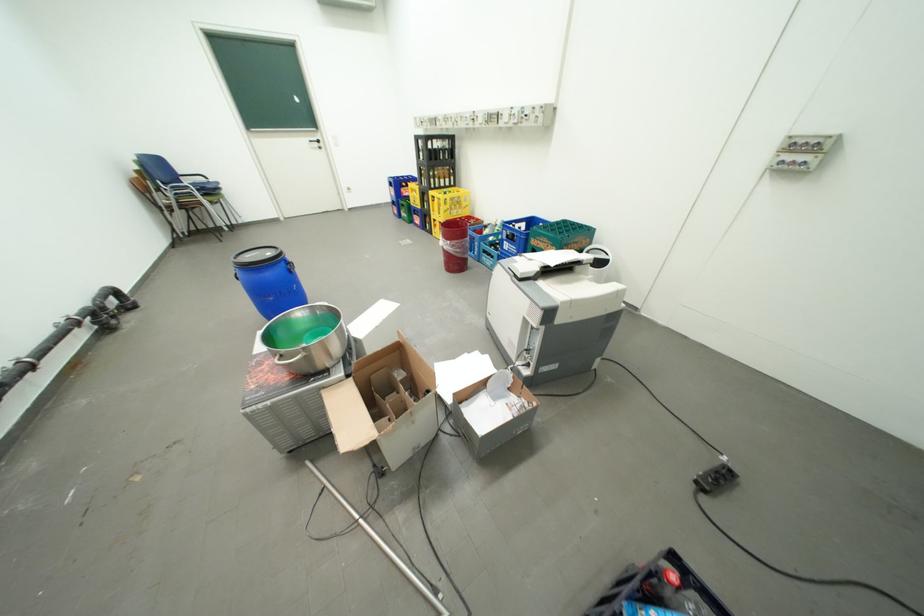
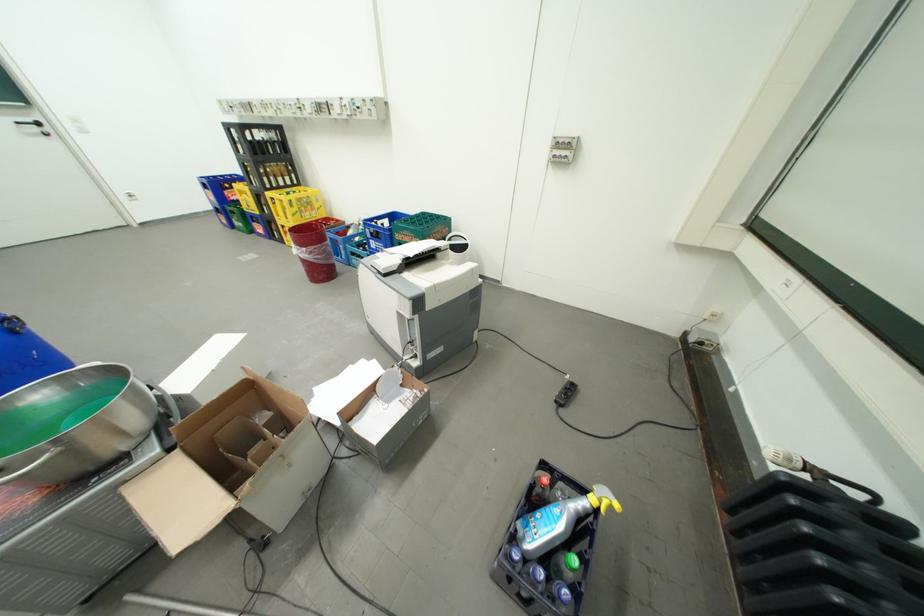
Locate, in the second image, the point that corresponds to pixel 459 212 in the first image.

(310, 215)